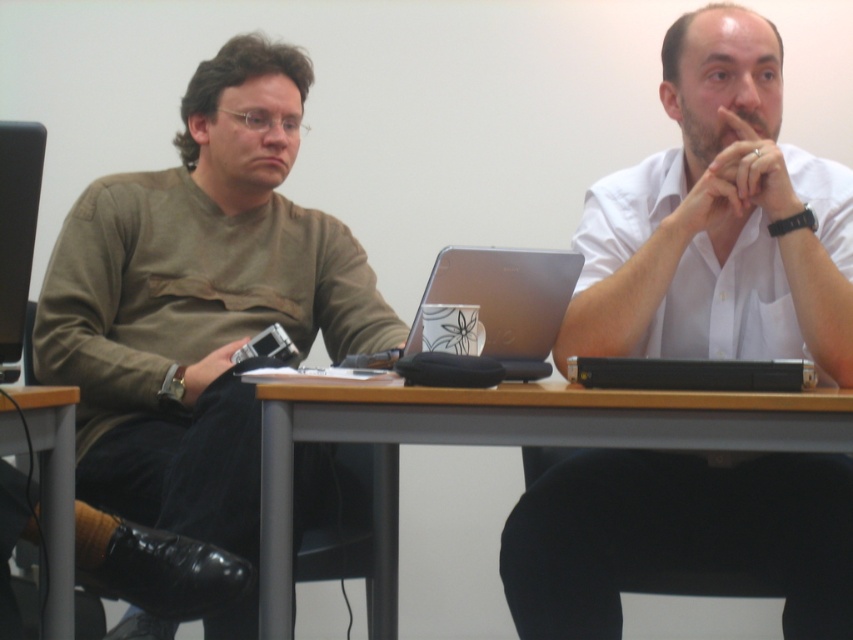
You are standing in the conference room and want to take a photo of the person in the brown shirt. The camera is at point (198, 301). Is the camera positioned to capture the person in the brown shirt?

The point (198, 301) corresponds to the matte brown shirt at left, so the camera is positioned to capture the person in the brown shirt.

You are standing in the conference room and want to hand a document to the person wearing the white smooth shirt at center. Which direction should you approach from relative to the matte brown shirt at left?

You should approach from the right side of the matte brown shirt at left because the white smooth shirt at center is closer to you than the matte brown shirt at left, meaning the white shirt is positioned to the right when viewed from your perspective.

Based on the coordinates provided, which object is exactly at point [718,221]?

The white smooth shirt at center is exactly at point [718,221].